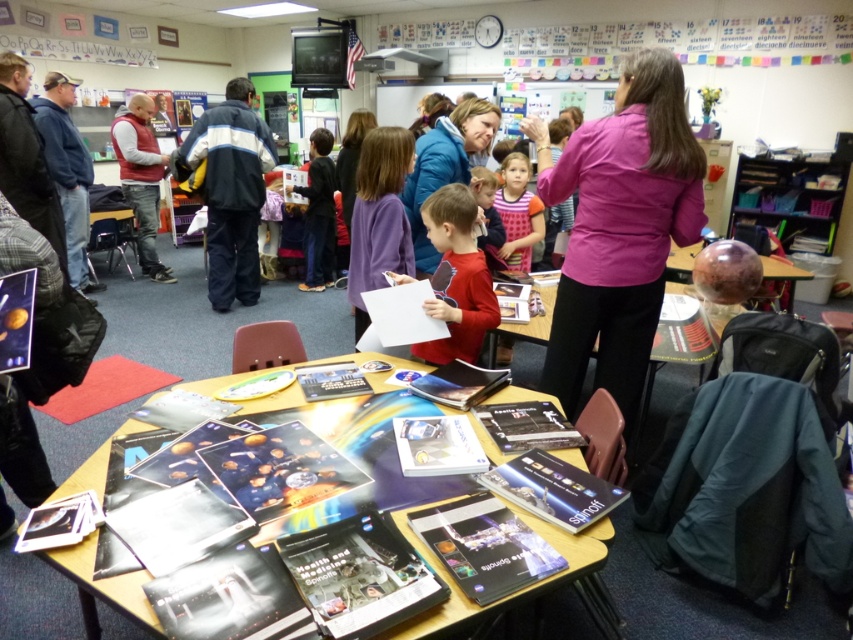
Is red matte shirt at center positioned before matte brown vest at left?

Yes.

Is red matte shirt at center bigger than matte brown vest at left?

No, red matte shirt at center is not bigger than matte brown vest at left.

Describe the element at coordinates (456, 278) in the screenshot. This screenshot has height=640, width=853. I see `red matte shirt at center` at that location.

I want to click on red matte shirt at center, so click(x=456, y=278).

Is point (476, 275) closer to camera compared to point (509, 260)?

That is True.

Where is `red matte shirt at center`? This screenshot has height=640, width=853. red matte shirt at center is located at coordinates (456, 278).

Between matte brown vest at left and pink dotted dress at center, which one appears on the right side from the viewer's perspective?

Positioned to the right is pink dotted dress at center.

Is matte brown vest at left shorter than pink dotted dress at center?

Incorrect, matte brown vest at left's height does not fall short of pink dotted dress at center's.

Where is `matte brown vest at left`? matte brown vest at left is located at coordinates (141, 177).